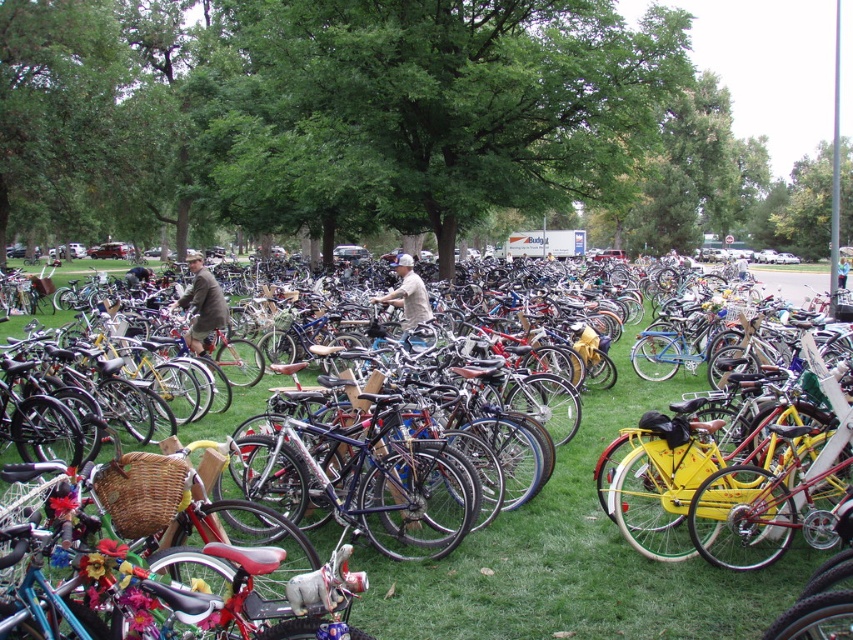
Based on the photo, where is the brown wool coat at center located in the image?

The brown wool coat at center is located at point 0.475 on the x axis and 0.238 on the y axis.

You are standing in the middle of the bicycle parking area and see the green grass at center and the beige cotton shirt at center. Which object is nearer to you?

The green grass at center is closer to the viewer than the beige cotton shirt at center, so the green grass at center is nearer to you.

You are standing in the middle of a bicycle parking area at an outdoor event. You notice a brown wool coat at center and a beige cotton shirt at center. Which item is nearer to you?

The brown wool coat at center is closer to the viewer than the beige cotton shirt at center, so the brown wool coat at center is nearer to you.